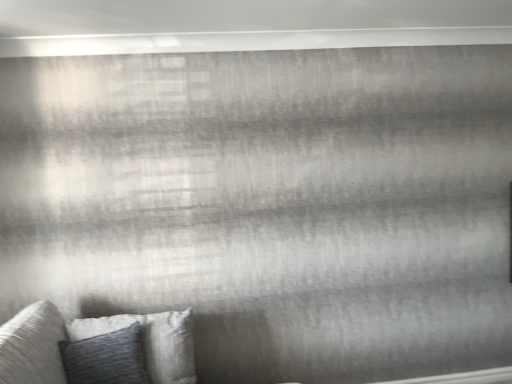
This screenshot has width=512, height=384. Describe the element at coordinates (151, 341) in the screenshot. I see `textured gray pillow at lower left` at that location.

Identify the location of textured gray pillow at lower left. (151, 341).

I want to click on textured gray pillow at lower left, so click(x=151, y=341).